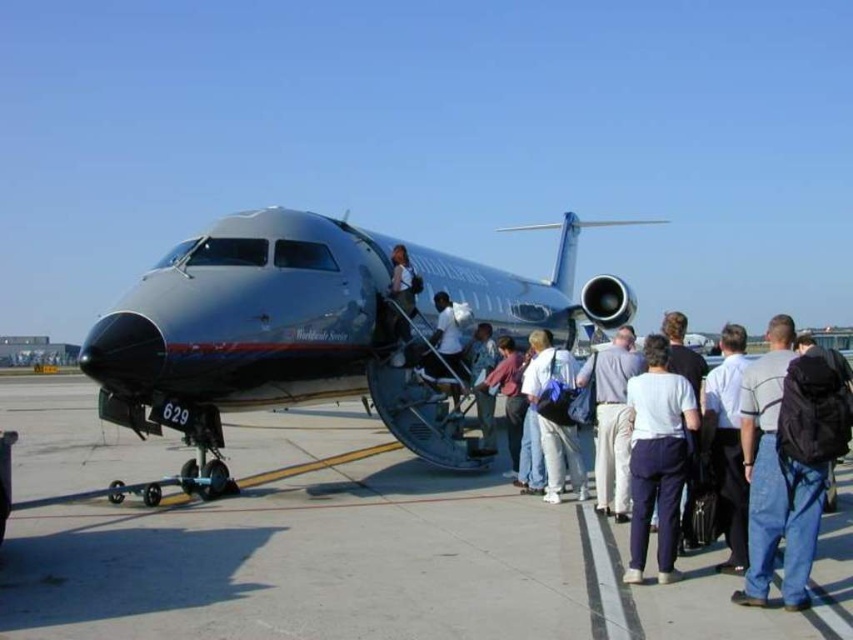
Question: Does light blue shirt at center have a lesser width compared to light blue fabric shirt at center?

Choices:
 (A) no
 (B) yes

Answer: (A)

Question: Which point is farther to the camera?

Choices:
 (A) (248, 428)
 (B) (352, 371)
 (C) (546, 381)

Answer: (A)

Question: Which object is farther from the camera taking this photo?

Choices:
 (A) white shirt at center
 (B) light blue fabric shirt at center
 (C) metallic gray airplane at center

Answer: (A)

Question: Can you confirm if denim pants at center is smaller than light blue fabric shirt at center?

Choices:
 (A) no
 (B) yes

Answer: (A)

Question: Estimate the real-world distances between objects in this image. Which object is farther from the gray concrete tarmac at lower center?

Choices:
 (A) white cotton shirt at center
 (B) denim pants at center
 (C) denim jeans at right

Answer: (C)

Question: From the image, what is the correct spatial relationship of metallic gray airplane at center in relation to white shirt at center?

Choices:
 (A) left
 (B) right

Answer: (B)